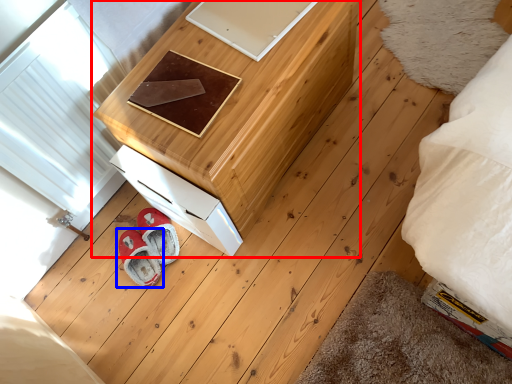
Question: Which object appears closest to the camera in this image, furniture (highlighted by a red box) or footwear (highlighted by a blue box)?

Choices:
 (A) furniture
 (B) footwear

Answer: (A)